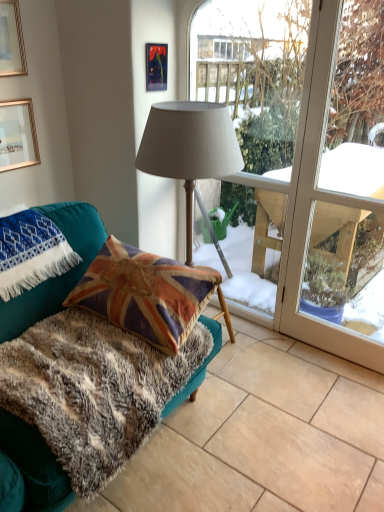
Question: Is fuzzy fabric rug at lower left surrounded by gold-framed picture at upper left, the third picture frame viewed from the right?

Choices:
 (A) no
 (B) yes

Answer: (A)

Question: Is gold-framed picture at upper left, marked as the 1th picture frame in a left-to-right arrangement, positioned in front of fuzzy fabric rug at lower left?

Choices:
 (A) no
 (B) yes

Answer: (A)

Question: Considering the relative sizes of gold-framed picture at upper left, marked as the 1th picture frame in a left-to-right arrangement, and fuzzy fabric rug at lower left in the image provided, is gold-framed picture at upper left, marked as the 1th picture frame in a left-to-right arrangement, shorter than fuzzy fabric rug at lower left?

Choices:
 (A) yes
 (B) no

Answer: (B)

Question: Is gold-framed picture at upper left, the third picture frame viewed from the right, in contact with fuzzy fabric rug at lower left?

Choices:
 (A) yes
 (B) no

Answer: (B)

Question: Is gold-framed picture at upper left, marked as the 1th picture frame in a left-to-right arrangement, facing towards fuzzy fabric rug at lower left?

Choices:
 (A) yes
 (B) no

Answer: (B)

Question: Considering the relative positions of gold-framed picture at upper left, marked as the 1th picture frame in a left-to-right arrangement, and fuzzy fabric rug at lower left in the image provided, is gold-framed picture at upper left, marked as the 1th picture frame in a left-to-right arrangement, to the left of fuzzy fabric rug at lower left from the viewer's perspective?

Choices:
 (A) no
 (B) yes

Answer: (B)

Question: Considering the relative sizes of fuzzy fabric rug at lower left and transparent glass window at center in the image provided, is fuzzy fabric rug at lower left bigger than transparent glass window at center?

Choices:
 (A) yes
 (B) no

Answer: (A)

Question: Is fuzzy fabric rug at lower left not close to transparent glass window at center?

Choices:
 (A) yes
 (B) no

Answer: (A)

Question: From a real-world perspective, is fuzzy fabric rug at lower left on top of transparent glass window at center?

Choices:
 (A) yes
 (B) no

Answer: (B)

Question: Is fuzzy fabric rug at lower left oriented towards transparent glass window at center?

Choices:
 (A) no
 (B) yes

Answer: (A)

Question: Is fuzzy fabric rug at lower left closer to camera compared to transparent glass window at center?

Choices:
 (A) yes
 (B) no

Answer: (A)

Question: Is fuzzy fabric rug at lower left at the right side of transparent glass window at center?

Choices:
 (A) yes
 (B) no

Answer: (A)

Question: Does teal fabric couch at lower left have a lesser width compared to fuzzy fabric rug at lower left?

Choices:
 (A) yes
 (B) no

Answer: (A)